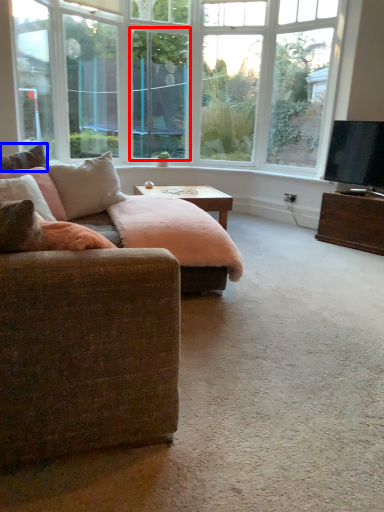
Question: Which point is further to the camera, window screen (highlighted by a red box) or pillow (highlighted by a blue box)?

Choices:
 (A) window screen
 (B) pillow

Answer: (A)